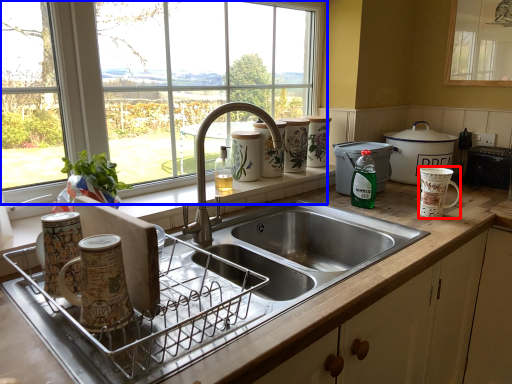
Question: Which object is further to the camera taking this photo, mug (highlighted by a red box) or window (highlighted by a blue box)?

Choices:
 (A) mug
 (B) window

Answer: (A)